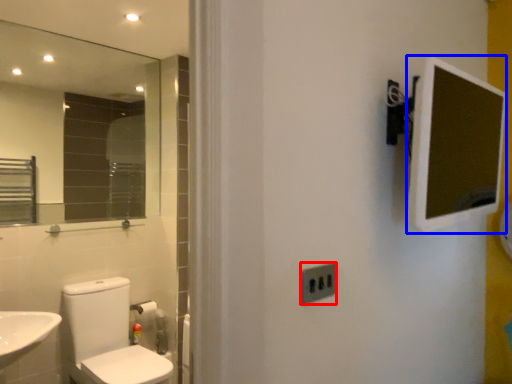
Question: Among these objects, which one is nearest to the camera, electric outlet (highlighted by a red box) or medicine cabinet (highlighted by a blue box)?

Choices:
 (A) electric outlet
 (B) medicine cabinet

Answer: (B)